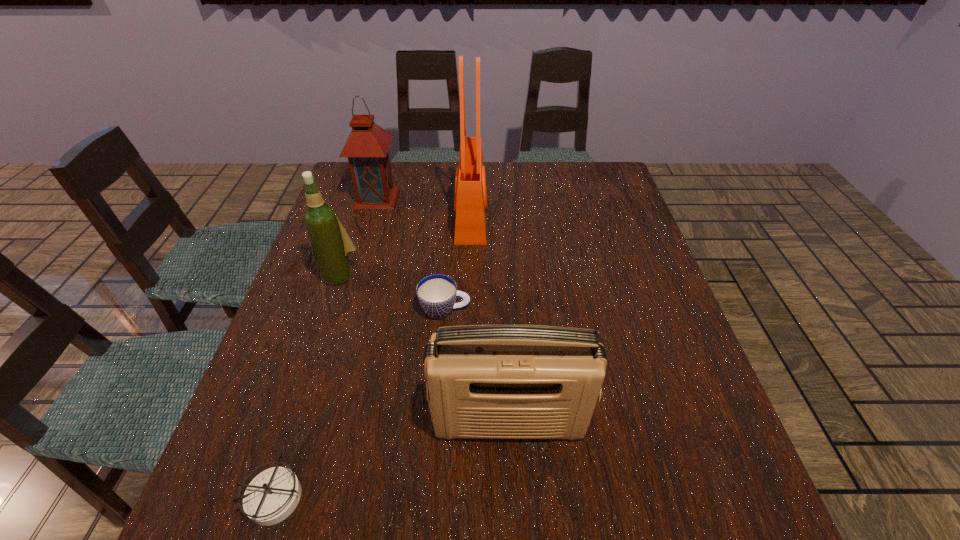
Image resolution: width=960 pixels, height=540 pixels. Identify the location of free location located 0.050m on the front-facing side of the radio receiver. point(512,471).

Locate an element on the screen. free space located on the side of the cup with the handle is located at coordinates (503, 309).

What are the coordinates of `blank space located on the back of the compass` in the screenshot? It's located at (321, 352).

Find the location of a particular element. tote bag at the far edge is located at coordinates (470, 204).

Identify the location of lantern that is at the far edge. (367, 146).

This screenshot has height=540, width=960. In order to click on object that is at the near edge in this screenshot , I will do `click(272, 495)`.

At what (x,y) coordinates should I click in order to perform the action: click on lantern present at the left edge. Please return your answer as a coordinate pair (x, y). This screenshot has width=960, height=540. Looking at the image, I should click on (367, 146).

Find the location of `wine bottle located at the left edge`. wine bottle located at the left edge is located at coordinates (331, 245).

In order to click on compass located at the left edge in this screenshot , I will do `click(272, 495)`.

Identify the location of object present at the far left corner. Image resolution: width=960 pixels, height=540 pixels. (367, 146).